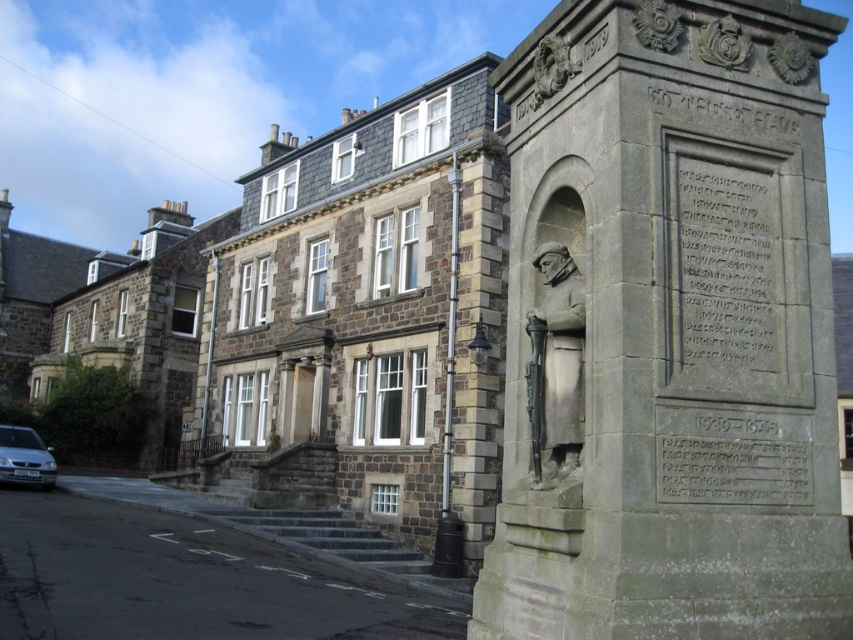
Question: Which of the following is the farthest from the observer?

Choices:
 (A) (759, 353)
 (B) (764, 125)
 (C) (598, 436)

Answer: (B)

Question: Is bronze statue at right bigger than silver metallic car at lower left?

Choices:
 (A) yes
 (B) no

Answer: (A)

Question: Which point is closer to the camera?

Choices:
 (A) (561, 355)
 (B) (602, 20)
 (C) (743, 202)

Answer: (C)

Question: Is bronze statue at center smaller than silver metallic car at lower left?

Choices:
 (A) yes
 (B) no

Answer: (A)

Question: Is black stone inscription at center wider than bronze statue at center?

Choices:
 (A) yes
 (B) no

Answer: (A)

Question: Considering the real-world distances, which object is farthest from the black stone inscription at center?

Choices:
 (A) bronze statue at center
 (B) bronze statue at right
 (C) silver metallic car at lower left
 (D) carved stone inscription at upper right

Answer: (C)